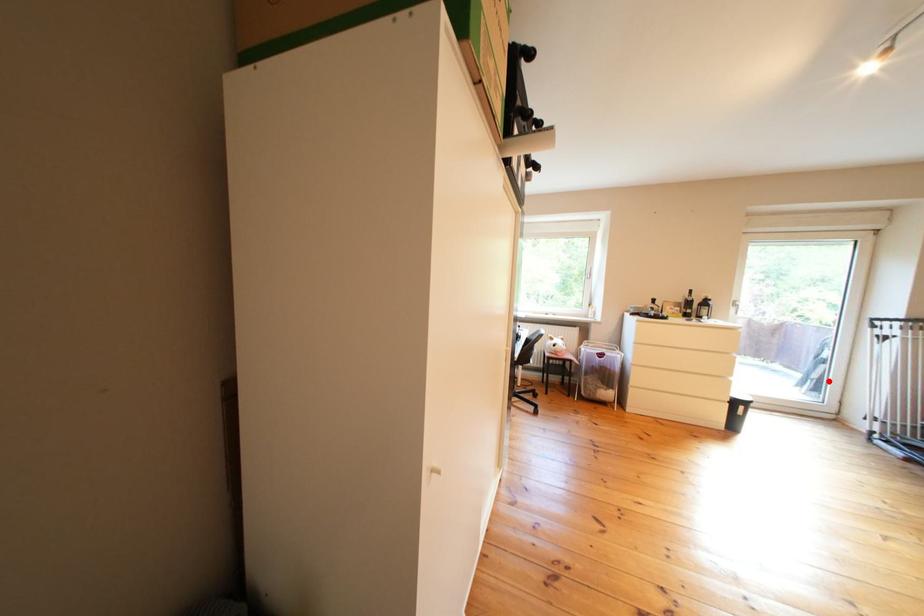
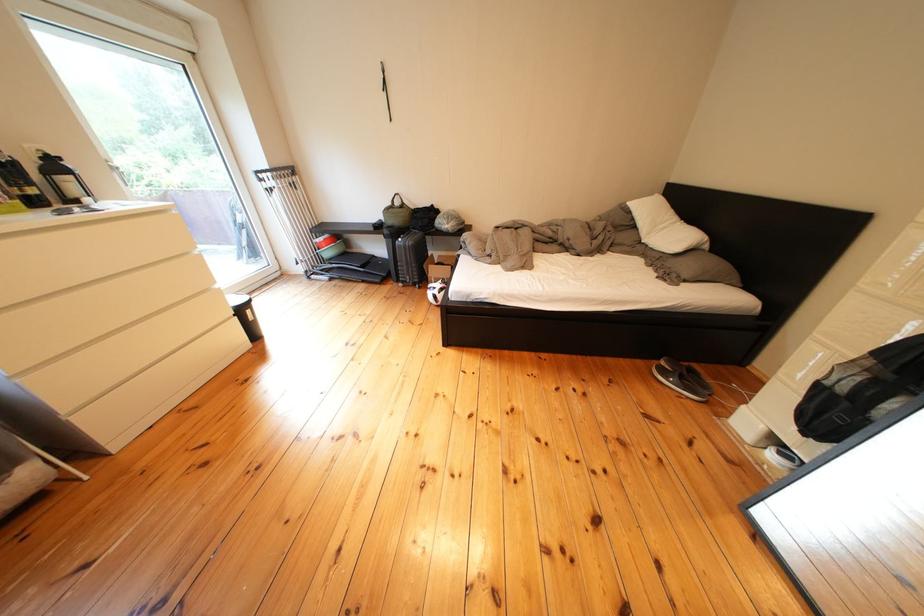
Question: I am providing you with two images of the same scene from different viewpoints. In image1, a red point is highlighted. Considering the same 3D point in image2, which of the following is correct?

Choices:
 (A) It is closer
 (B) It is farther

Answer: (A)